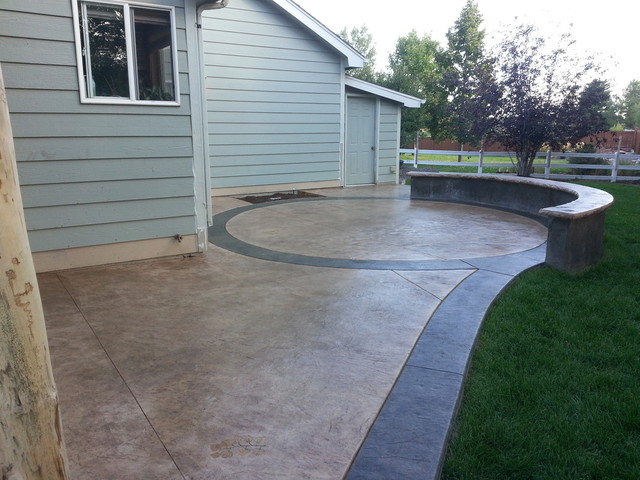
This screenshot has width=640, height=480. I want to click on brick wall, so click(x=630, y=140).